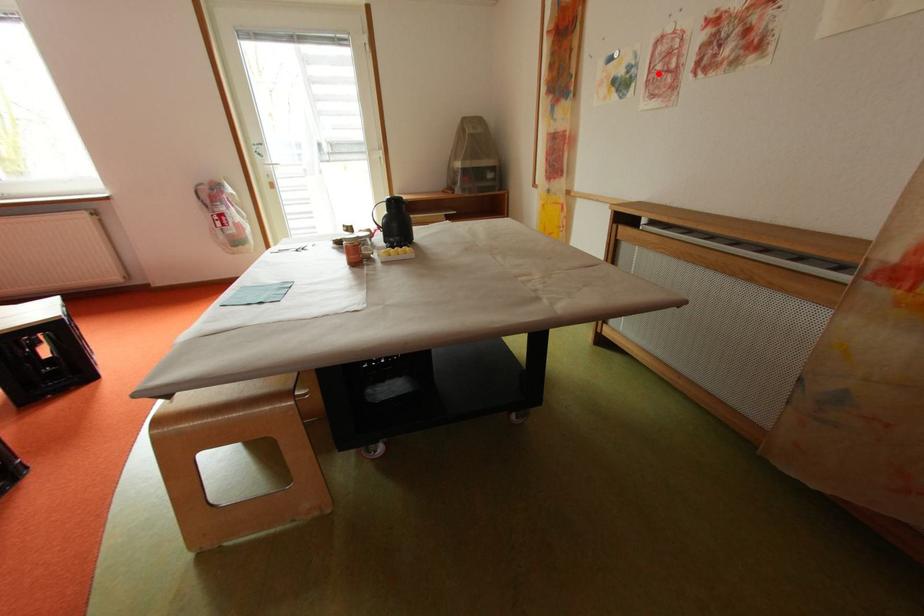
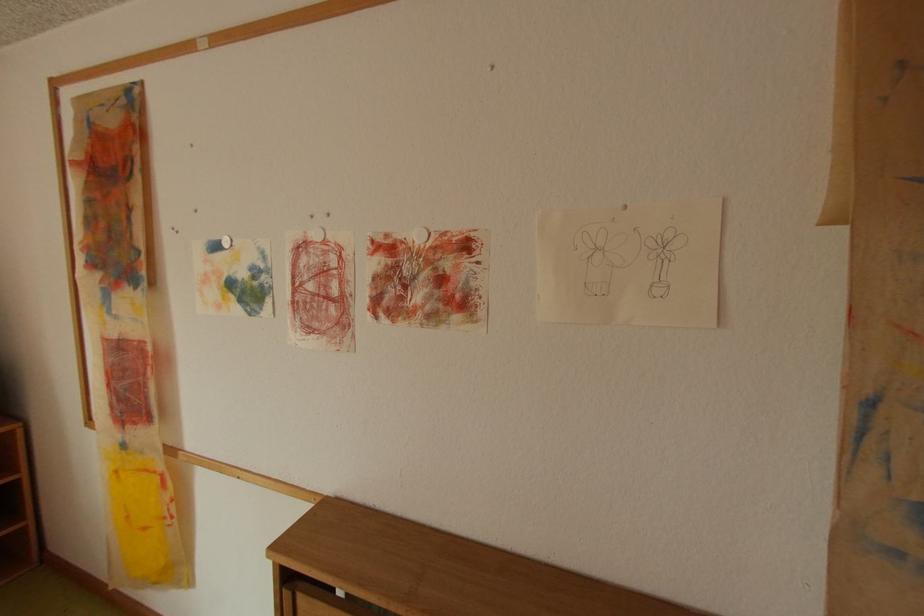
The point at the highlighted location is marked in the first image. Where is the corresponding point in the second image?

(304, 292)